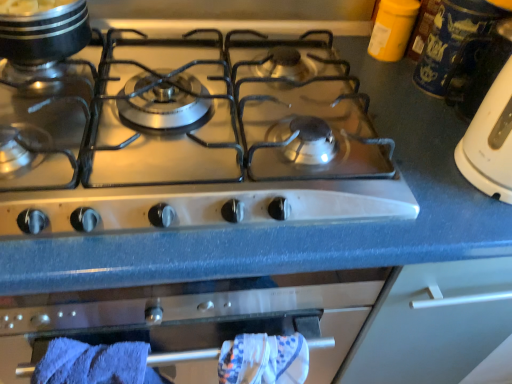
Identify the location of vacant space to the left of blue ceramic mug at upper right. This screenshot has height=384, width=512. (374, 87).